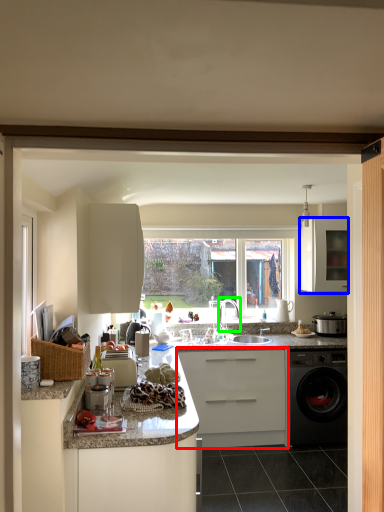
Question: Considering the real-world distances, which object is farthest from cabinetry (highlighted by a red box)? cabinetry (highlighted by a blue box) or tap (highlighted by a green box)?

Choices:
 (A) cabinetry
 (B) tap

Answer: (A)